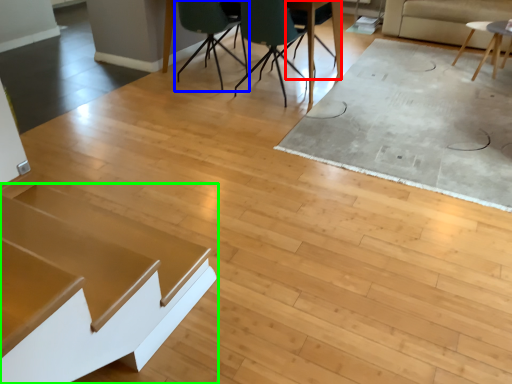
Question: Which object is positioned farthest from chair (highlighted by a red box)? Select from chair (highlighted by a blue box) and table (highlighted by a green box).

Choices:
 (A) chair
 (B) table

Answer: (B)